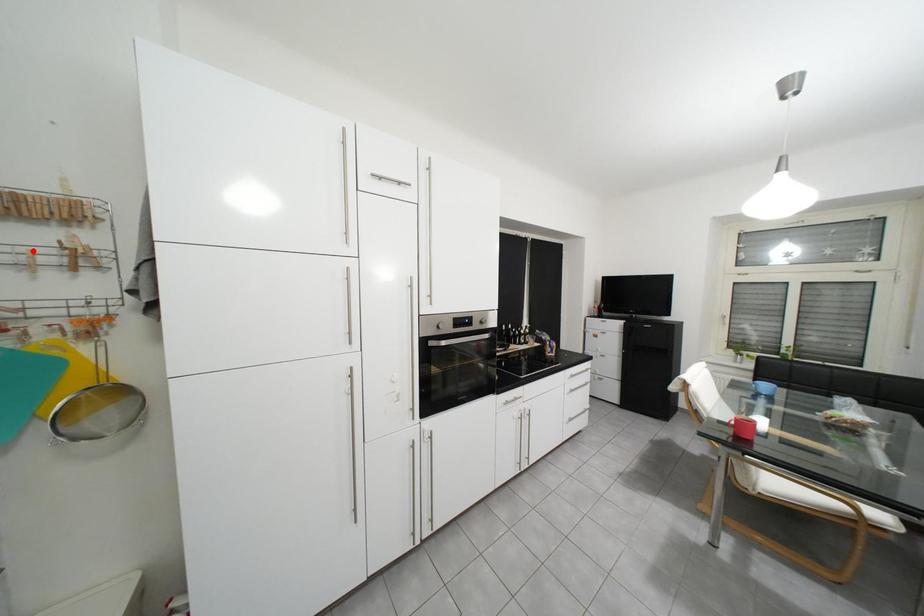
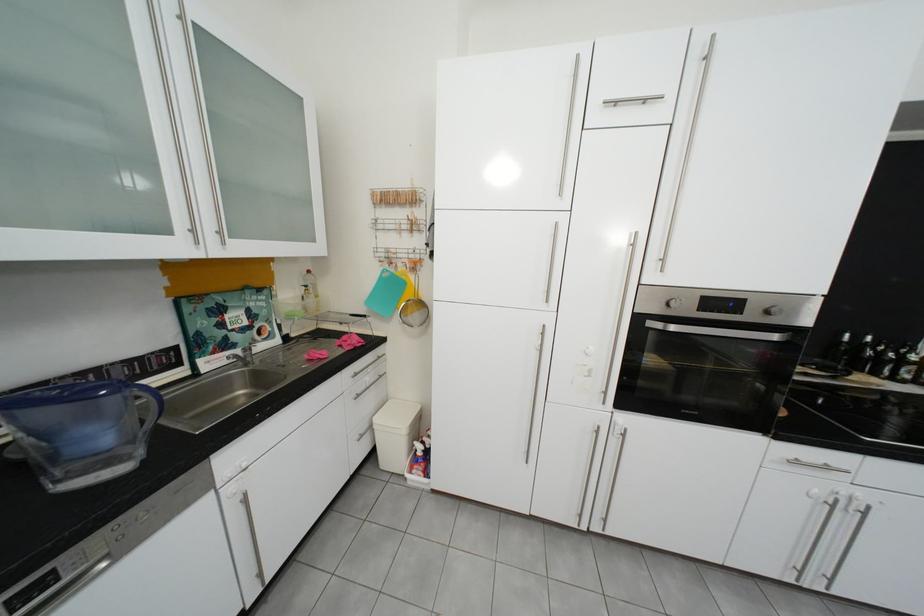
Where in the second image is the point corresponding to the highlighted location from the first image?

(408, 223)